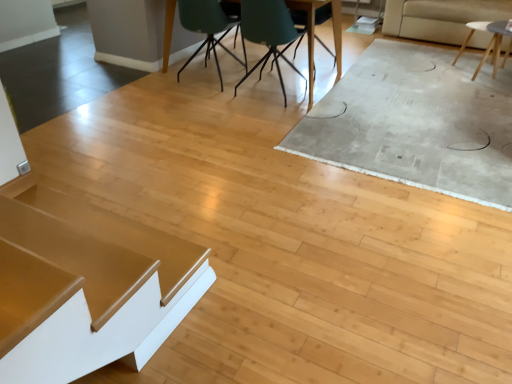
Locate an element on the screen. Image resolution: width=512 pixels, height=384 pixels. vacant area that is situated to the right of shiny gold table at lower left, the 3th table from the right is located at coordinates (242, 291).